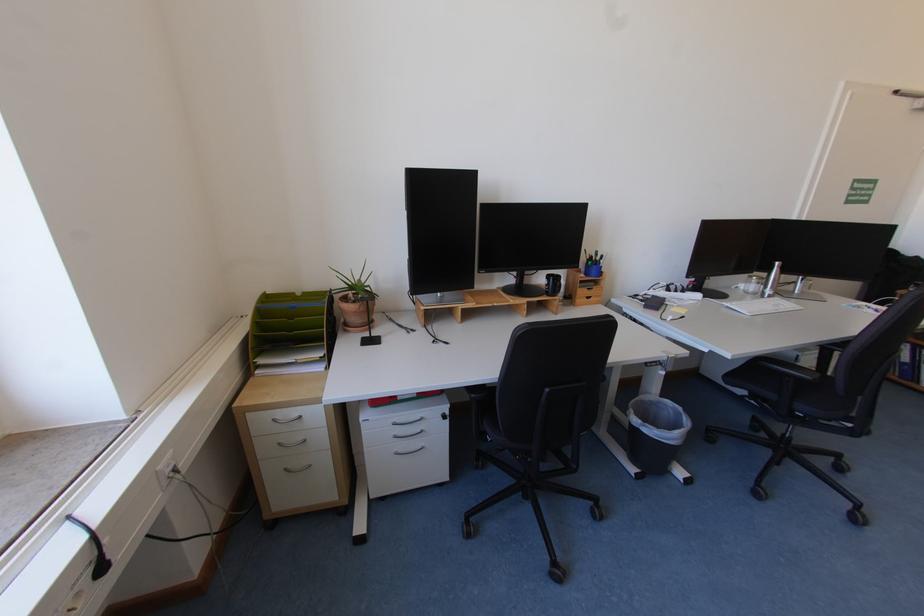
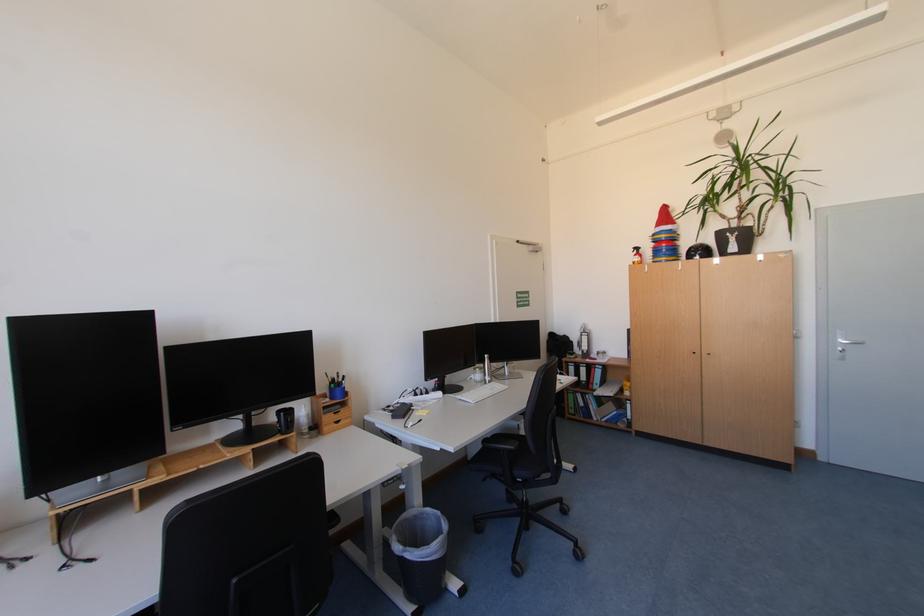
Question: The camera is either moving clockwise (left) or counter-clockwise (right) around the object. The first image is from the beginning of the video and the second image is from the end. Is the camera moving left or right when shooting the video?

Choices:
 (A) Left
 (B) Right

Answer: (A)